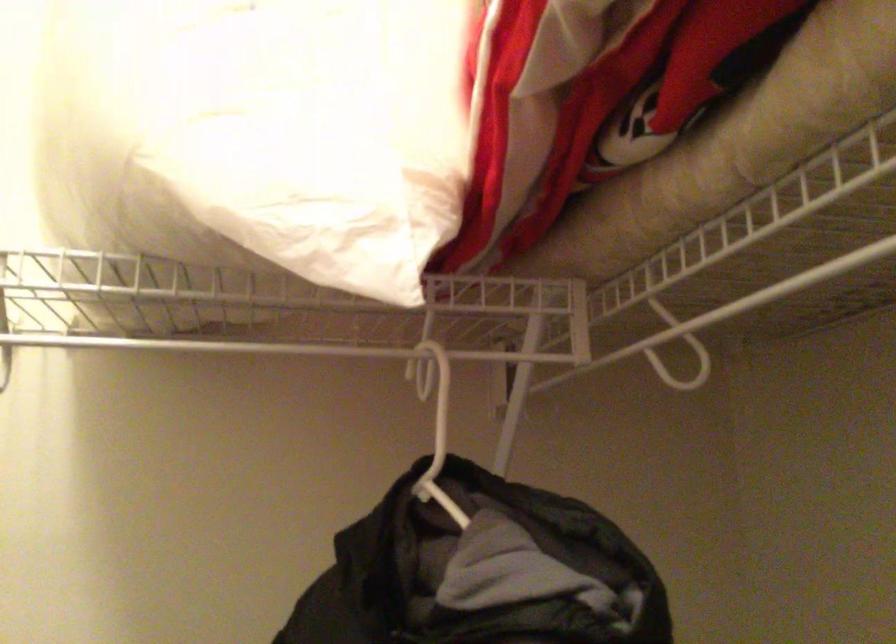
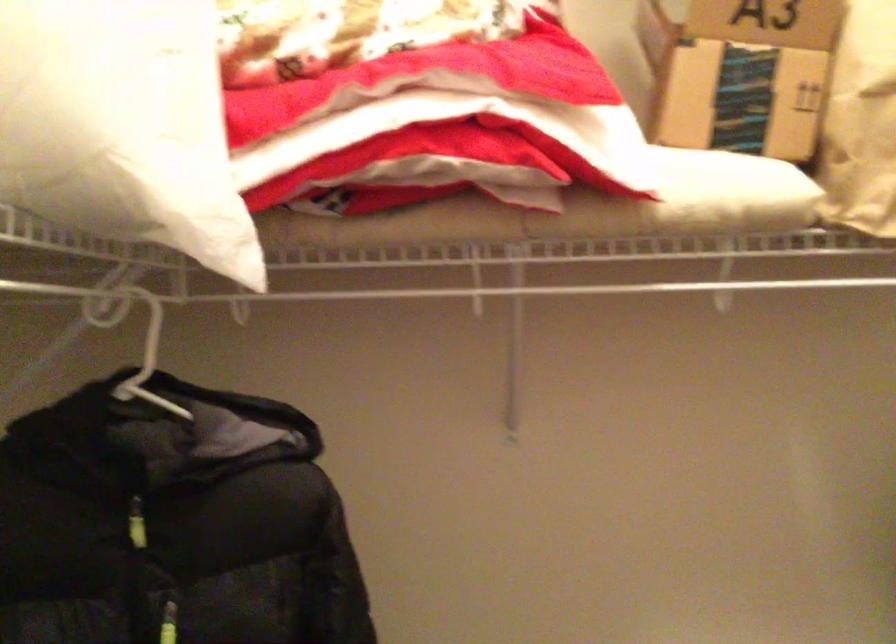
Question: The camera is either moving clockwise (left) or counter-clockwise (right) around the object. The first image is from the beginning of the video and the second image is from the end. Is the camera moving left or right when shooting the video?

Choices:
 (A) Left
 (B) Right

Answer: (A)